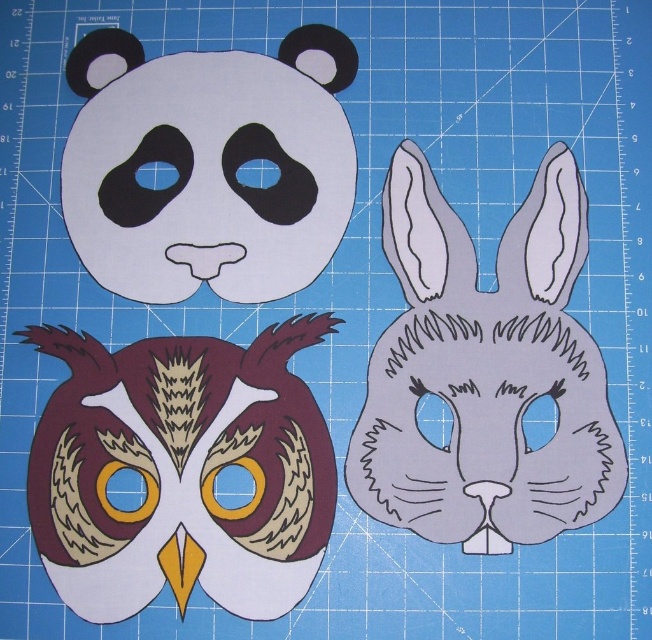
Is matte brown owl at center shorter than matte brown owl mask at center?

Incorrect, matte brown owl at center's height does not fall short of matte brown owl mask at center's.

Based on the photo, who is positioned more to the left, matte brown owl at center or matte brown owl mask at center?

matte brown owl mask at center is more to the left.

Locate an element on the screen. matte brown owl at center is located at coordinates (484, 371).

Does point (604, 458) lie behind point (312, 218)?

No, it is not.

Is point (531, 275) less distant than point (143, 157)?

That is True.

Where is `matte brown owl at center`? Image resolution: width=652 pixels, height=640 pixels. matte brown owl at center is located at coordinates (484, 371).

Does matte brown owl mask at center have a larger size compared to matte brown paper owl at upper left?

Incorrect, matte brown owl mask at center is not larger than matte brown paper owl at upper left.

Describe the element at coordinates (181, 472) in the screenshot. I see `matte brown owl mask at center` at that location.

Who is more distant from viewer, (93, 564) or (171, 120)?

Point (171, 120)

Find the location of a particular element. The height and width of the screenshot is (640, 652). matte brown owl mask at center is located at coordinates (181, 472).